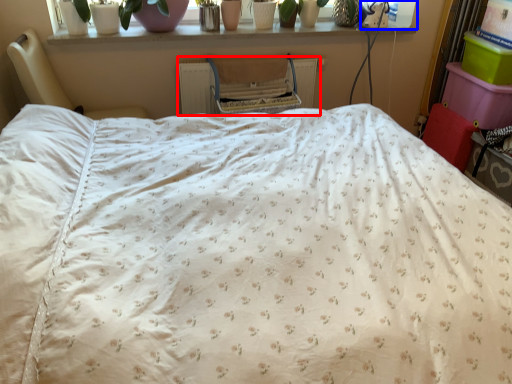
Question: Which point is further to the camera, radiator (highlighted by a red box) or window screen (highlighted by a blue box)?

Choices:
 (A) radiator
 (B) window screen

Answer: (B)